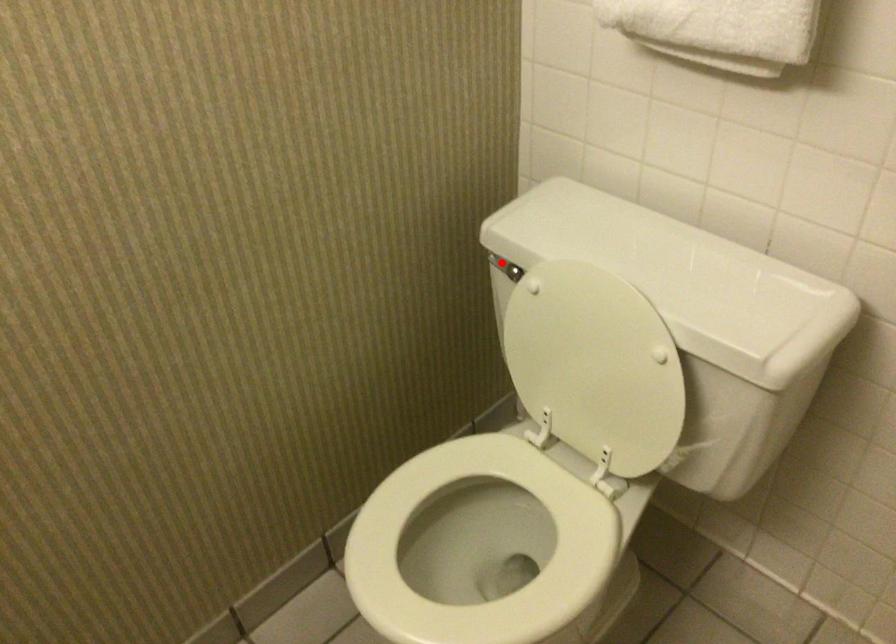
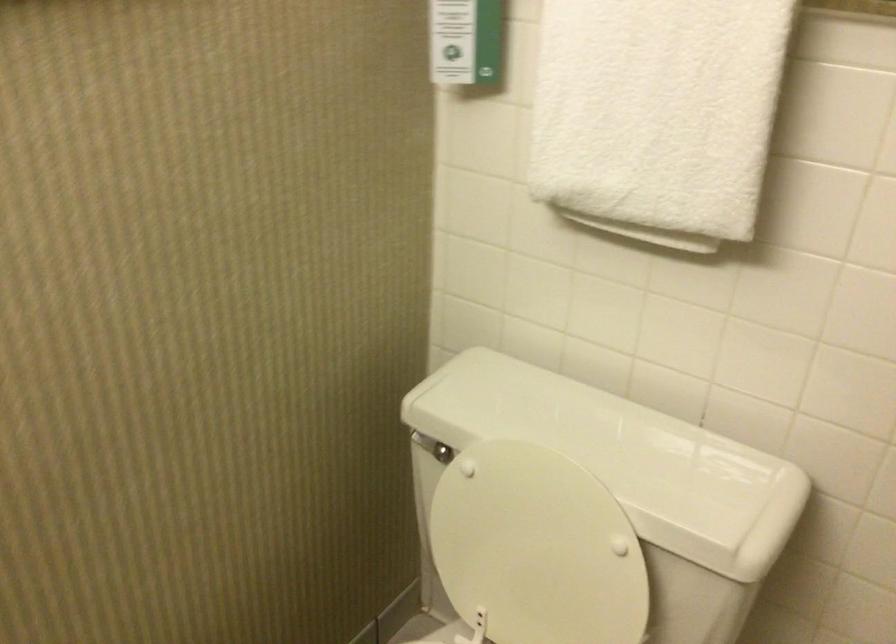
The point at the highlighted location is marked in the first image. Where is the corresponding point in the second image?

(425, 444)